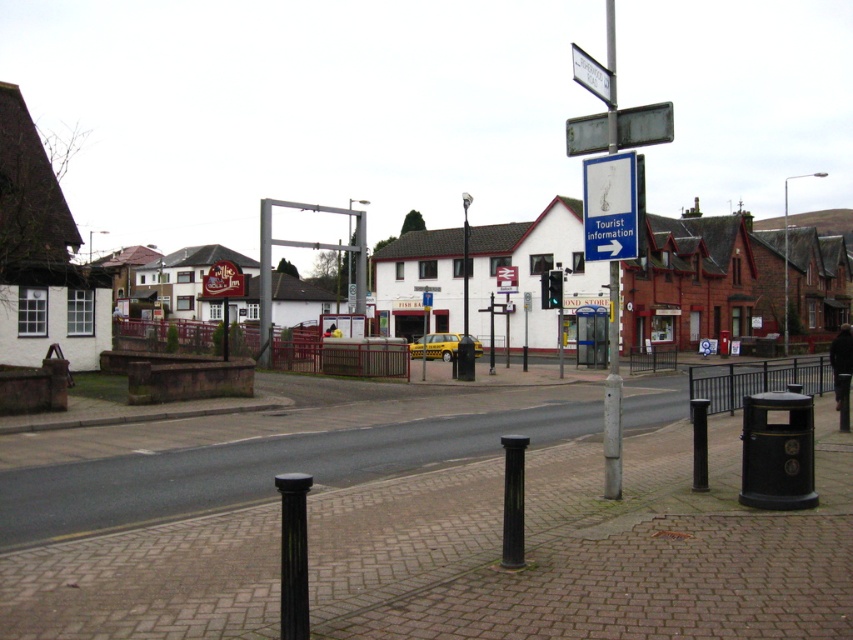
You are standing at the crossroads in the image and want to walk towards the point that is closer to you. Which point should you head towards, point (614, 394) or point (657, 129)?

You should head towards point (657, 129) because it is closer to you than point (614, 394), which is further away.

You are a delivery person trying to navigate through the town. You notice a silver metallic pole at center and a white plastic street sign at upper center. Which object is wider?

The silver metallic pole at center is wider than the white plastic street sign at upper center according to the description.

You are a delivery driver who needs to park your van between the white painted building at center and the metallic street sign at upper center. Given that your van is 2 meters wide, can you fit it there?

The white painted building at center is wider than the metallic street sign at upper center. However, the description does not provide exact measurements of their widths, so it is impossible to determine if the space between them is sufficient for a 2 meter wide van.